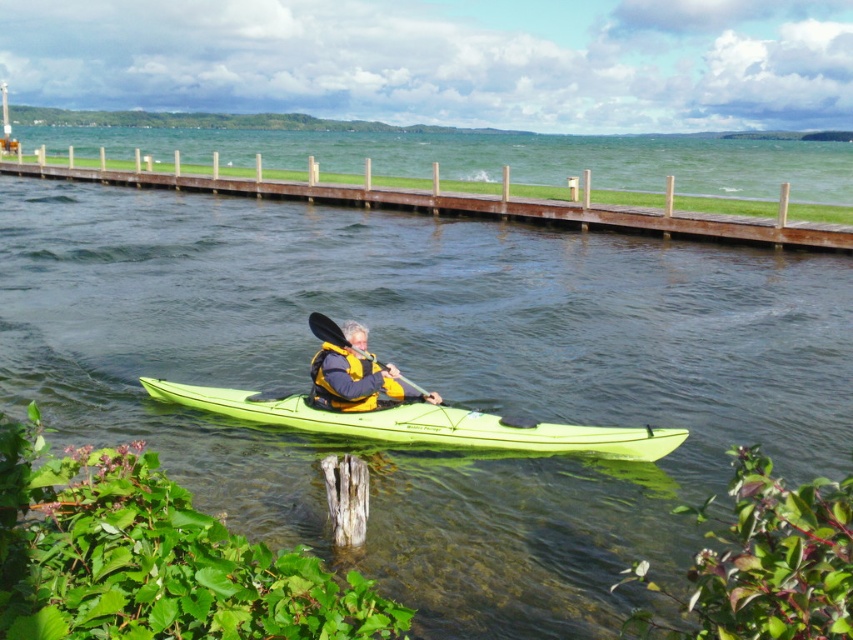
Is brown wooden dock at upper center wider than black textured paddle at center?

Yes, brown wooden dock at upper center is wider than black textured paddle at center.

Between point (763, 227) and point (521, 422), which one is positioned in front?

Positioned in front is point (521, 422).

Where is `brown wooden dock at upper center`? Image resolution: width=853 pixels, height=640 pixels. brown wooden dock at upper center is located at coordinates pos(474,204).

Is point (776, 224) less distant than point (326, 337)?

No, it is not.

Does brown wooden dock at upper center have a lesser width compared to yellow life vest at center?

In fact, brown wooden dock at upper center might be wider than yellow life vest at center.

Locate an element on the screen. The height and width of the screenshot is (640, 853). brown wooden dock at upper center is located at coordinates (474, 204).

This screenshot has height=640, width=853. Find the location of `brown wooden dock at upper center`. brown wooden dock at upper center is located at coordinates (474, 204).

Does brown wooden dock at upper center have a lesser height compared to matte green kayak at center?

Incorrect, brown wooden dock at upper center's height does not fall short of matte green kayak at center's.

Who is lower down, brown wooden dock at upper center or matte green kayak at center?

matte green kayak at center is below.

What do you see at coordinates (474, 204) in the screenshot? The width and height of the screenshot is (853, 640). I see `brown wooden dock at upper center` at bounding box center [474, 204].

This screenshot has width=853, height=640. Find the location of `brown wooden dock at upper center`. brown wooden dock at upper center is located at coordinates pyautogui.click(x=474, y=204).